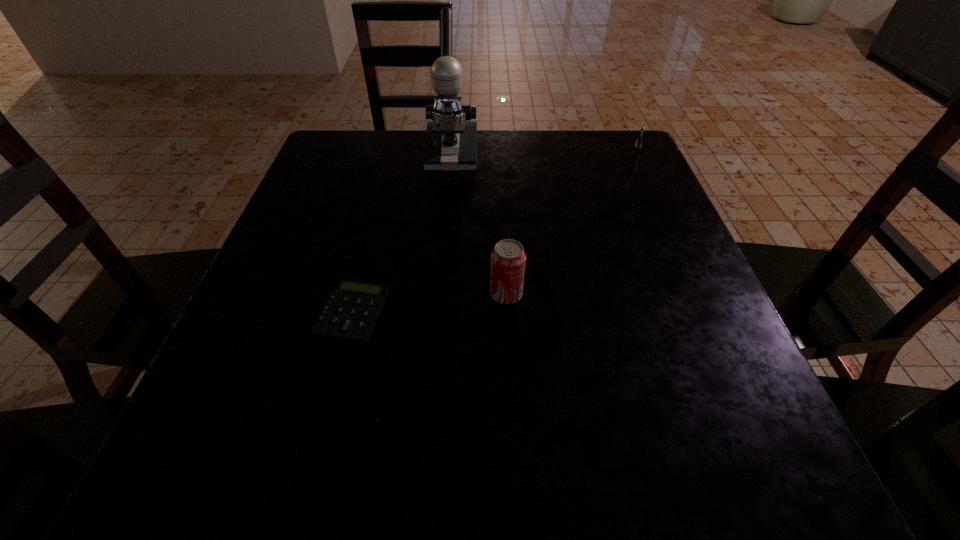
Where is `vacant point located between the padlock and the tallest object`? The image size is (960, 540). vacant point located between the padlock and the tallest object is located at coordinates (543, 157).

Locate an element on the screen. The image size is (960, 540). vacant area that lies between the second object from right to left and the shortest object is located at coordinates (429, 303).

Where is `free space that is in between the shortest object and the second object from right to left`? The height and width of the screenshot is (540, 960). free space that is in between the shortest object and the second object from right to left is located at coordinates (429, 303).

Find the location of a particular element. The height and width of the screenshot is (540, 960). empty space that is in between the soda can and the second object from left to right is located at coordinates (479, 225).

Identify the location of free space that is in between the third shortest object and the second shortest object. The height and width of the screenshot is (540, 960). (570, 227).

Identify which object is the third nearest to the shortest object. Please provide its 2D coordinates. Your answer should be formatted as a tuple, i.e. [(x, y)], where the tuple contains the x and y coordinates of a point satisfying the conditions above.

[(637, 148)]

At what (x,y) coordinates should I click in order to perform the action: click on object that is the third closest one to the third shortest object. Please return your answer as a coordinate pair (x, y). This screenshot has height=540, width=960. Looking at the image, I should click on (637, 148).

In order to click on vacant region that satisfies the following two spatial constraints: 1. at the eyepiece of the padlock; 2. on the left side of the microscope in this screenshot , I will do `click(451, 158)`.

This screenshot has height=540, width=960. I want to click on free region that satisfies the following two spatial constraints: 1. at the eyepiece of the padlock; 2. on the right side of the microscope, so click(451, 158).